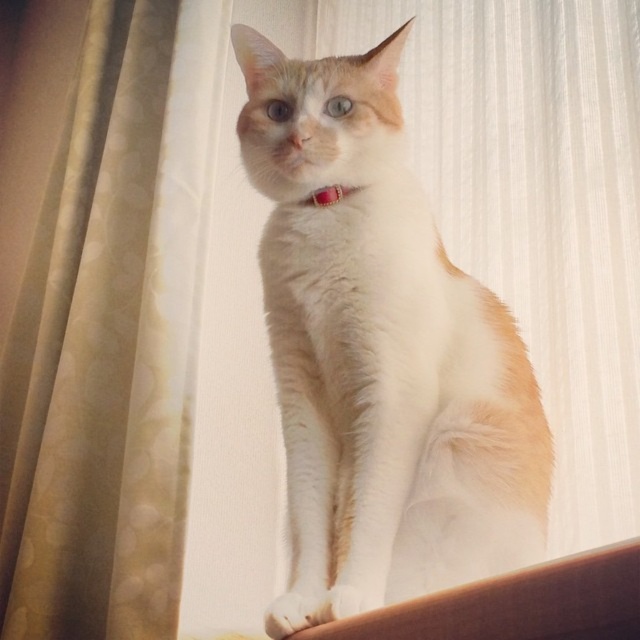
You are positioning a small toy for the white fur cat at center. If the windowsill runs horizontally from left to right, where should you place the toy relative to the cat to ensure it stays within the windowsill area?

The white fur cat at center is located at point 0.553 on the x axis and 0.595 on the y axis. Since the windowsill runs horizontally, the toy should be placed along the same y axis position to stay within the windowsill area.

Based on the photo, you are a photographer trying to capture a closeup of the white fur cat at center and the rubber band at center. Your camera can focus on objects within a 5 inch range. Can you focus on both objects at the same time?

The white fur cat at center is 9.14 inches from the rubber band at center, which is beyond the 5 inch focus range. Therefore, you cannot focus on both objects simultaneously.

You are a photographer setting up a shot of the cat. You need to adjust the lighting so that the beige textured curtain at left and the rubber band at center are both visible. Which object should you move closer to the light source to ensure both are well lit?

The beige textured curtain at left is positioned under the rubber band at center. To ensure both are well lit, move the beige textured curtain at left closer to the light source so that the light can reach both objects without being blocked by the rubber band at center.